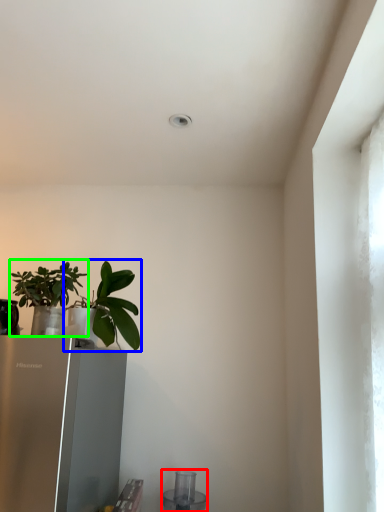
Question: Which object is the farthest from appliance (highlighted by a red box)? Choose among these: houseplant (highlighted by a blue box) or houseplant (highlighted by a green box).

Choices:
 (A) houseplant
 (B) houseplant

Answer: (B)